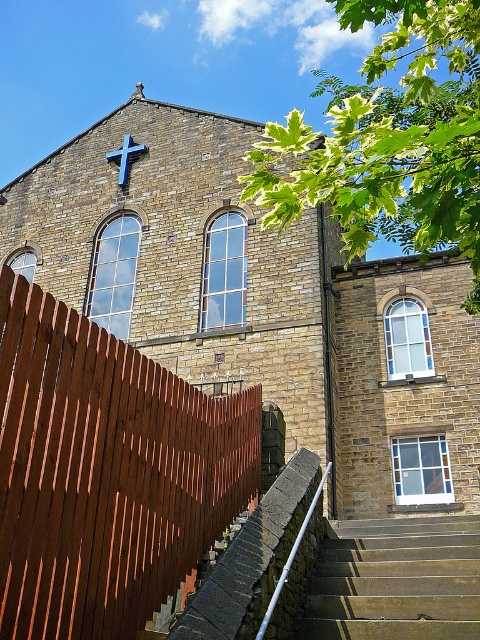
You are standing at the entrance of the stone building and want to know the position of the brown wooden fence at left. Based on the coordinates provided, is it closer to the top or bottom of the image?

The brown wooden fence at left is located at point (106,472), which means it is closer to the bottom of the image since the y coordinate is lower.

From the picture: You are standing in front of the stone building and want to take a photo of the blue painted wood cross at upper center without the brown wooden fence at left appearing in the frame. Which direction should you move to achieve this?

The brown wooden fence at left is to the right of the blue painted wood cross at upper center. To avoid including the brown wooden fence at left in the photo, you should move to the left side of the blue painted wood cross at upper center.

You are a painter hired to paint the brown wooden fence at left and the blue painted wood cross at upper center. You need to determine which object requires a taller ladder. Based on the scene, which one needs a taller ladder?

The brown wooden fence at left is much taller than the blue painted wood cross at upper center, so the painter will need a taller ladder for the brown wooden fence at left.